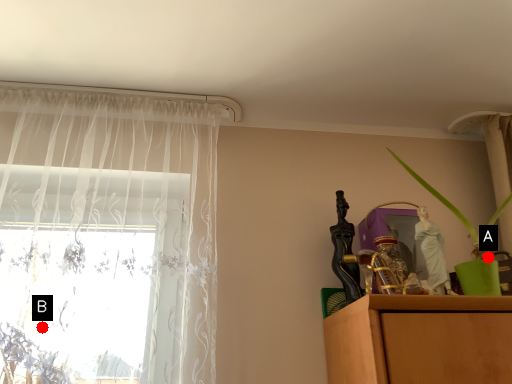
Question: Two points are circled on the image, labeled by A and B beside each circle. Which point is closer to the camera?

Choices:
 (A) A is closer
 (B) B is closer

Answer: (B)